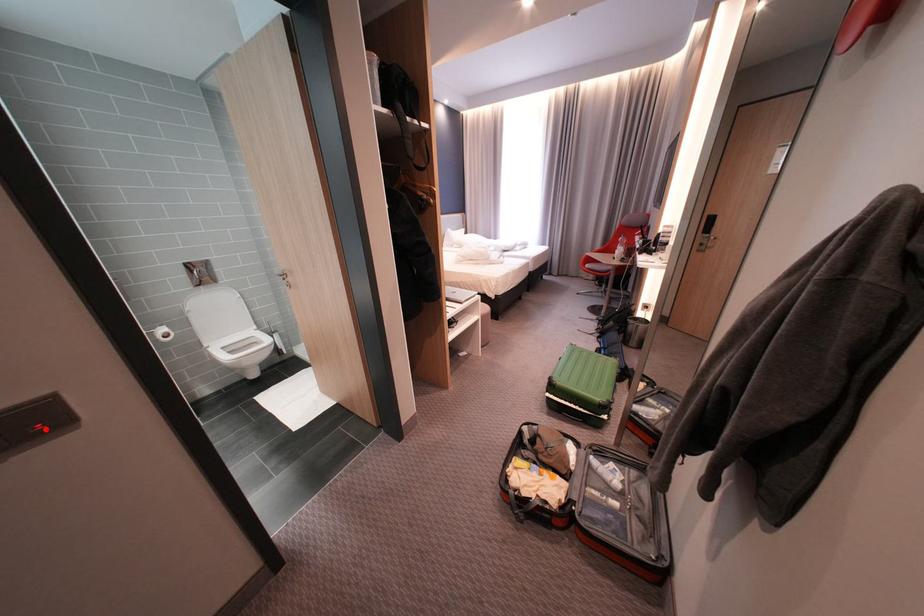
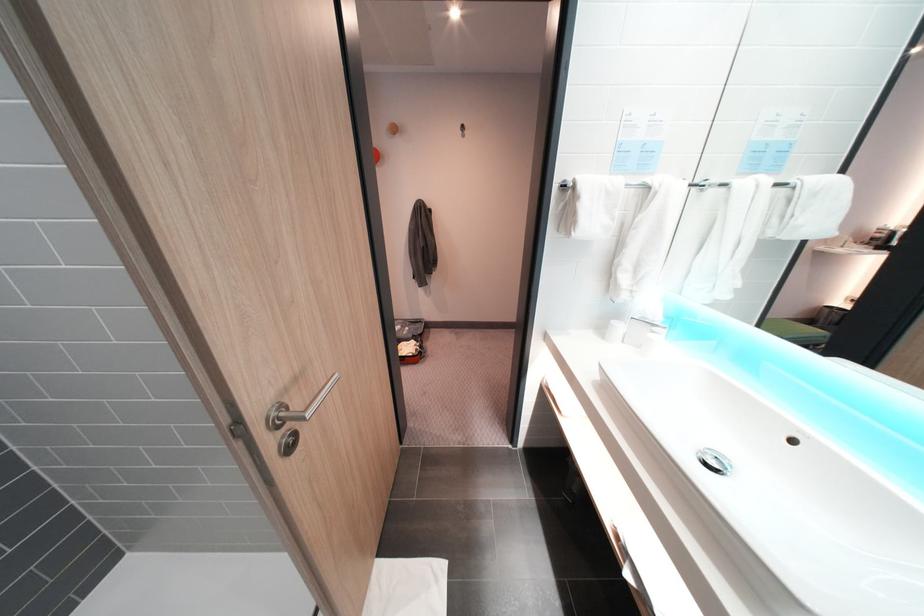
Question: I am providing you with two images of the same scene from different viewpoints. A red point is marked on the first image. At the location where the point appears in image 1, is it still visible in image 2?

Choices:
 (A) Yes
 (B) No

Answer: (B)